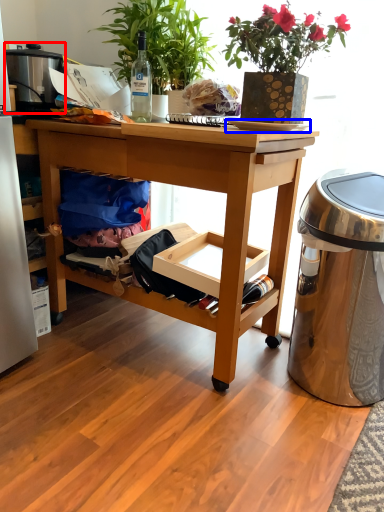
Question: Which object appears closest to the camera in this image, appliance (highlighted by a red box) or plate (highlighted by a blue box)?

Choices:
 (A) appliance
 (B) plate

Answer: (B)